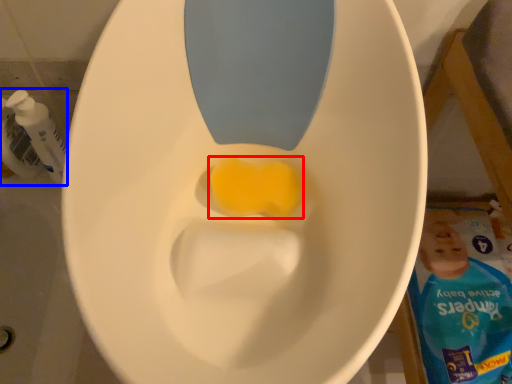
Question: Which of the following is the farthest to the observer, food (highlighted by a red box) or cleaning product (highlighted by a blue box)?

Choices:
 (A) food
 (B) cleaning product

Answer: (B)